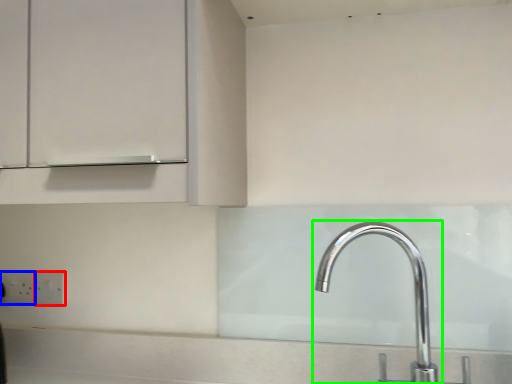
Question: Based on their relative distances, which object is farther from electric outlet (highlighted by a red box)? Choose from electric outlet (highlighted by a blue box) and tap (highlighted by a green box).

Choices:
 (A) electric outlet
 (B) tap

Answer: (B)